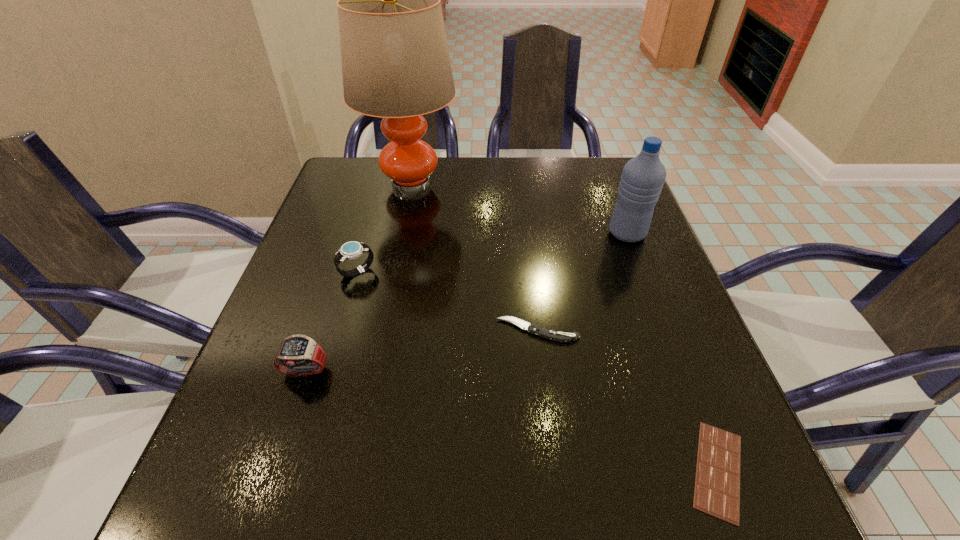
The image size is (960, 540). What are the coordinates of `the farthest object` in the screenshot? It's located at (395, 60).

This screenshot has height=540, width=960. What are the coordinates of `lamp` in the screenshot? It's located at (x=395, y=60).

This screenshot has height=540, width=960. What are the coordinates of `the fifth nearest object` in the screenshot? It's located at (642, 179).

Locate an element on the screen. This screenshot has width=960, height=540. water bottle is located at coordinates (642, 179).

In order to click on the farther watch in this screenshot , I will do `click(351, 250)`.

Locate an element on the screen. This screenshot has height=540, width=960. the nearer watch is located at coordinates (298, 355).

I want to click on the second shortest object, so click(533, 328).

At what (x,y) coordinates should I click in order to perform the action: click on the fourth farthest object. Please return your answer as a coordinate pair (x, y). Looking at the image, I should click on (533, 328).

I want to click on chocolate bar, so click(717, 481).

Image resolution: width=960 pixels, height=540 pixels. Find the location of `the shortest object`. the shortest object is located at coordinates (717, 481).